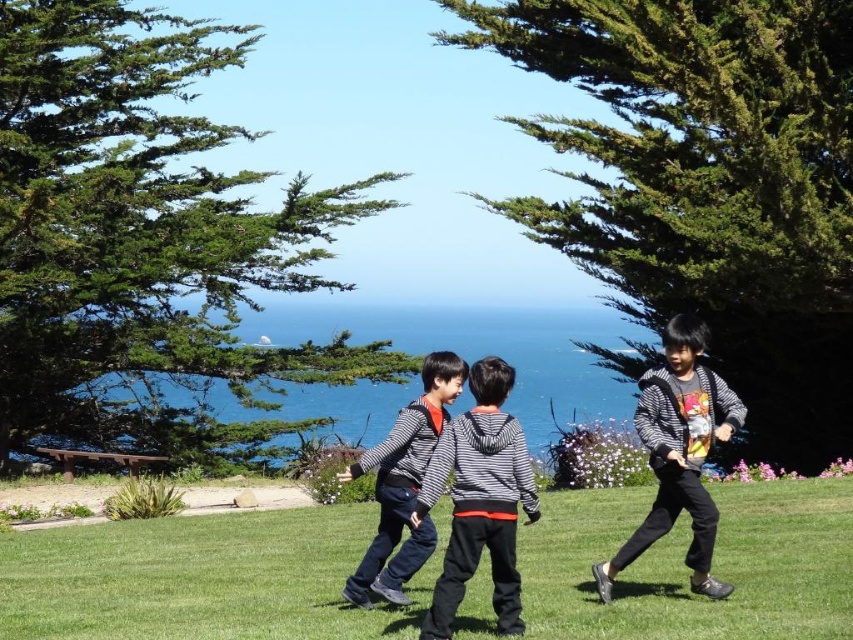
Question: Which is farther from the green textured pine at upper left?

Choices:
 (A) green textured pine at center
 (B) green grass at center
 (C) striped cotton hoodie at center
 (D) striped fabric jacket at center

Answer: (C)

Question: Among these points, which one is farthest from the camera?

Choices:
 (A) (529, 516)
 (B) (399, 419)
 (C) (813, 625)

Answer: (B)

Question: Does striped cotton hoodie at center appear over striped sweater at right?

Choices:
 (A) yes
 (B) no

Answer: (B)

Question: Is striped cotton hoodie at center wider than striped sweater at right?

Choices:
 (A) no
 (B) yes

Answer: (A)

Question: Which point is closer to the camera?

Choices:
 (A) 666,102
 (B) 721,410
 (C) 431,394
 (D) 432,480

Answer: (D)

Question: Does green textured pine at center come in front of striped cotton hoodie at center?

Choices:
 (A) yes
 (B) no

Answer: (B)